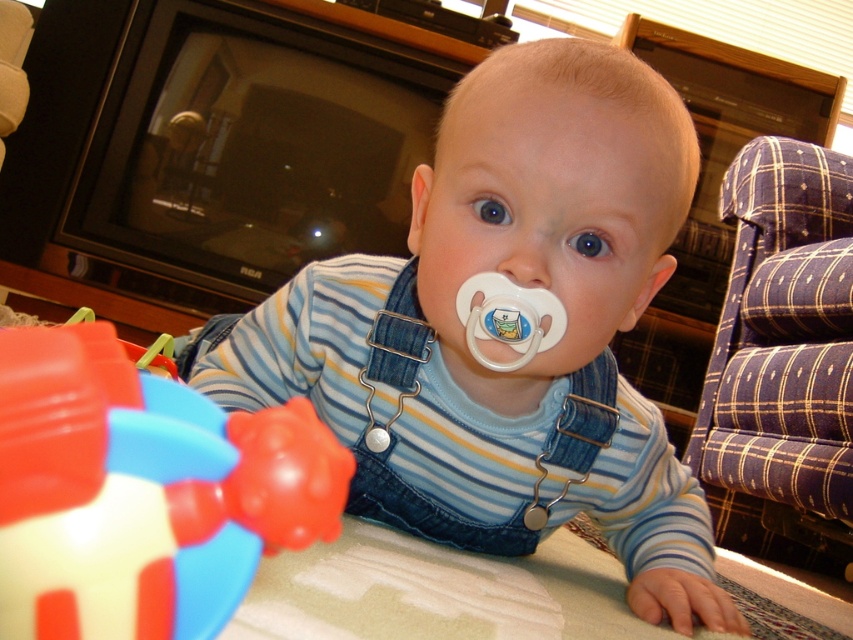
Does matte plastic pacifier at center appear under rubberized plastic cube at lower left?

No.

Can you confirm if matte plastic pacifier at center is positioned to the right of rubberized plastic cube at lower left?

Indeed, matte plastic pacifier at center is positioned on the right side of rubberized plastic cube at lower left.

Describe the element at coordinates (508, 328) in the screenshot. I see `matte plastic pacifier at center` at that location.

The height and width of the screenshot is (640, 853). In order to click on matte plastic pacifier at center in this screenshot , I will do `click(508, 328)`.

Does matte plastic pacifier at center have a larger size compared to blue plaid fabric armchair at right?

Actually, matte plastic pacifier at center might be smaller than blue plaid fabric armchair at right.

Does matte plastic pacifier at center have a greater height compared to blue plaid fabric armchair at right?

No, matte plastic pacifier at center is not taller than blue plaid fabric armchair at right.

This screenshot has width=853, height=640. What are the coordinates of `matte plastic pacifier at center` in the screenshot? It's located at (508, 328).

At what (x,y) coordinates should I click in order to perform the action: click on matte plastic pacifier at center. Please return your answer as a coordinate pair (x, y). This screenshot has width=853, height=640. Looking at the image, I should click on [x=508, y=328].

Which is behind, point (189, 456) or point (796, 300)?

The point (796, 300) is behind.

Is rubberized plastic cube at lower left above blue plaid fabric armchair at right?

Incorrect, rubberized plastic cube at lower left is not positioned above blue plaid fabric armchair at right.

Which is in front, point (35, 621) or point (706, 460)?

Point (35, 621) is in front.

At what (x,y) coordinates should I click in order to perform the action: click on rubberized plastic cube at lower left. Please return your answer as a coordinate pair (x, y). The height and width of the screenshot is (640, 853). Looking at the image, I should click on (142, 492).